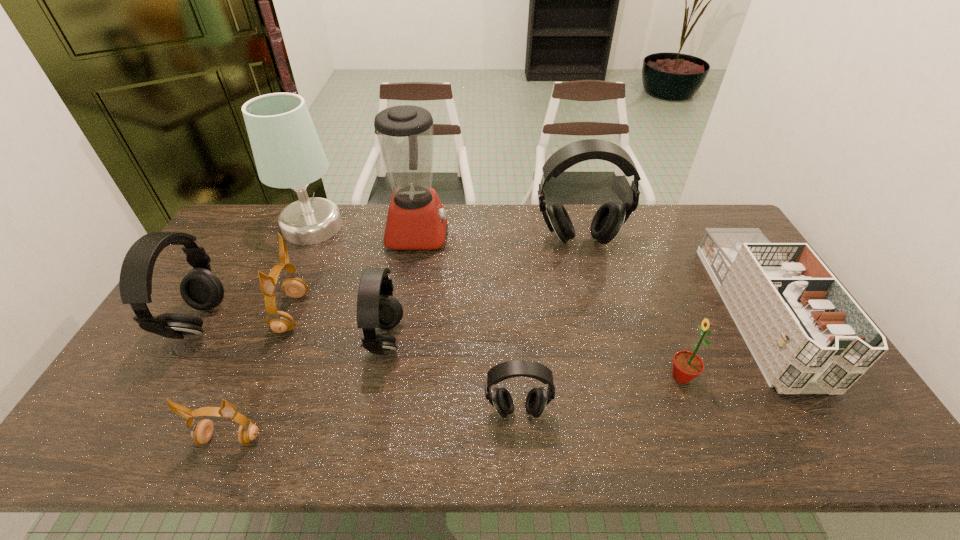
Locate an element on the screen. The height and width of the screenshot is (540, 960). blender is located at coordinates (416, 220).

Locate an element on the screen. lampshade is located at coordinates (287, 151).

The height and width of the screenshot is (540, 960). Identify the location of the rightmost earphone. (608, 220).

Identify the location of the third tallest object. This screenshot has width=960, height=540. (608, 220).

Where is `the leftmost black earphone`? the leftmost black earphone is located at coordinates (201, 289).

At what (x,y) coordinates should I click in order to perform the action: click on the leftmost earphone. Please return your answer as a coordinate pair (x, y). Looking at the image, I should click on (201, 289).

I want to click on the bigger brown earphone, so click(279, 321).

Where is `the third biggest black earphone`? the third biggest black earphone is located at coordinates (376, 307).

Locate an element on the screen. The height and width of the screenshot is (540, 960). the third earphone from right to left is located at coordinates (376, 307).

At what (x,y) coordinates should I click in order to perform the action: click on green sunflower. Please return your answer as a coordinate pair (x, y). This screenshot has width=960, height=540. Looking at the image, I should click on (686, 365).